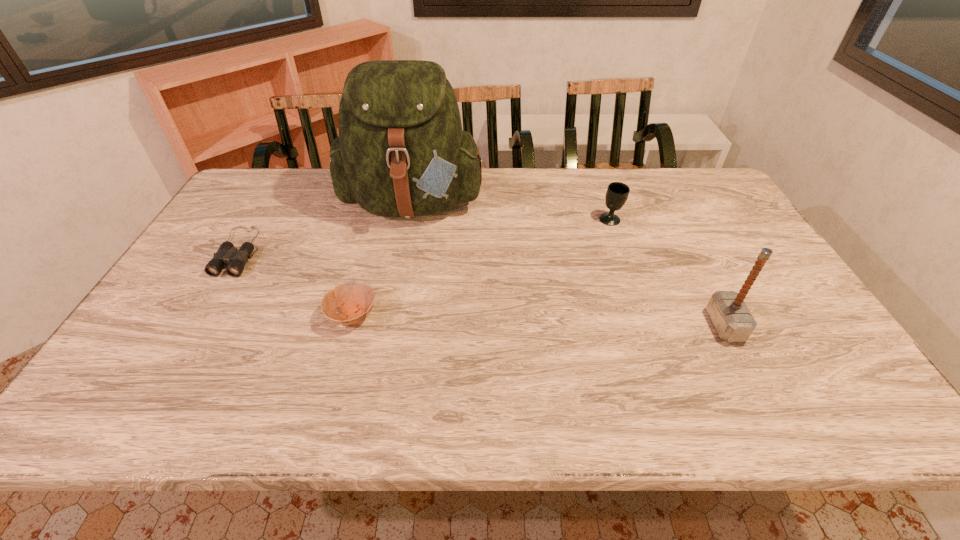
The width and height of the screenshot is (960, 540). What are the coordinates of `free space located 0.110m on the striking surface of the hammer` in the screenshot? It's located at 666,325.

This screenshot has height=540, width=960. In order to click on vacant area situated 0.230m on the striking surface of the hammer in this screenshot , I will do `click(617, 325)`.

Locate an element on the screen. free region located 0.130m on the back of the second object from right to left is located at coordinates (600, 191).

The image size is (960, 540). I want to click on vacant region located 0.200m on the back of the second shortest object, so click(x=372, y=247).

Locate an element on the screen. The width and height of the screenshot is (960, 540). vacant space positioned at the eyepiece of the binoculars is located at coordinates (204, 308).

The height and width of the screenshot is (540, 960). Identify the location of object at the far edge. (401, 152).

Locate an element on the screen. The height and width of the screenshot is (540, 960). object located in the left edge section of the desktop is located at coordinates (236, 259).

Identify the location of vacant space at the far edge of the desktop. [300, 177].

Image resolution: width=960 pixels, height=540 pixels. In the image, there is a desktop. Find the location of `vacant space at the near edge`. vacant space at the near edge is located at coordinates (252, 408).

Identify the location of vacant space at the left edge of the desktop. (200, 297).